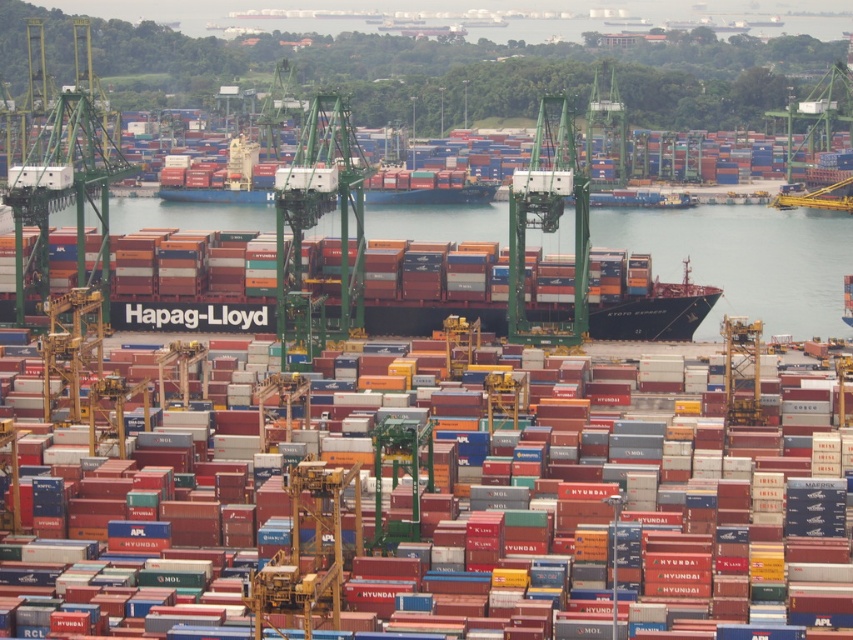
You are a crane operator at the port. You need to lower a new container onto the existing ones. The new container is the same size as the metallic gray container at center. To ensure it doesn not fall into the transparent water at center, what should you do?

Since the transparent water at center is not as tall as the metallic gray container at center, you should position the new container so that it is placed on top of or adjacent to the metallic gray container at center, ensuring it stays above the lower level of the transparent water at center.

You are a port engineer planning to install a new sensor between the transparent water at center and the metallic gray container at center. The sensor requires a minimum distance of 40 meters between the two objects to function properly. Based on the scene description, will the sensor work effectively?

The transparent water at center and metallic gray container at center are 45.72 meters apart, which exceeds the sensor requirement of 40 meters. Therefore, the sensor will work effectively between them.

You are a crane operator at the port and need to lower a new container onto the deck of the ship labeled Hapag. The deck has limited space. You have two options for placement near the center of the deck. One spot is over the transparent water at center, and the other is next to the metallic gray container at center. Which location has more space available for the container?

The transparent water at center is bigger than the metallic gray container at center, so there is more space available over the transparent water at center for placing the new container.